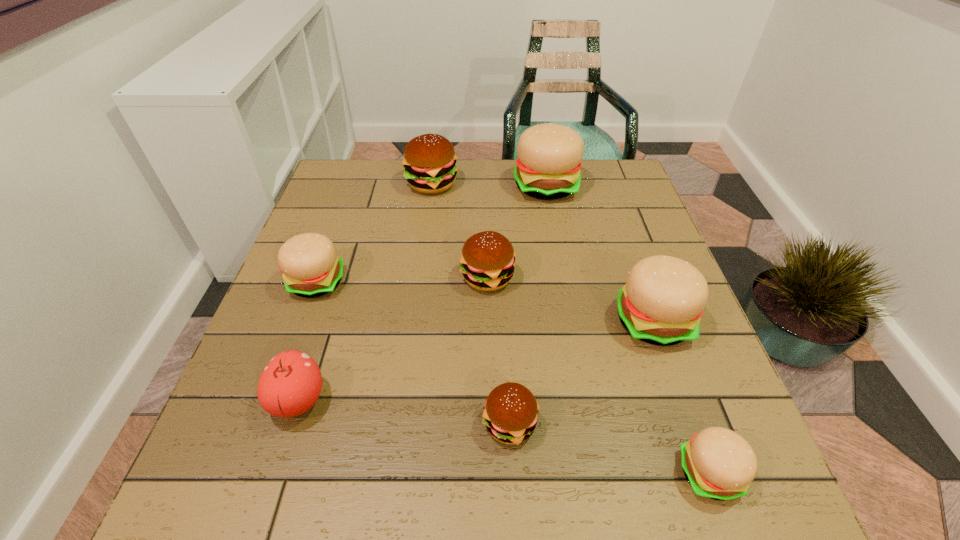
At what (x,y) coordinates should I click in order to perform the action: click on vacant point located 0.070m on the right of the farthest beige hamburger. Please return your answer as a coordinate pair (x, y). The height and width of the screenshot is (540, 960). Looking at the image, I should click on (602, 186).

Identify the location of free region located 0.390m on the right of the third object from left to right. (591, 184).

This screenshot has width=960, height=540. I want to click on vacant space located on the back of the third smallest beige hamburger, so click(617, 221).

At what (x,y) coordinates should I click in order to perform the action: click on vacant space located 0.320m on the back of the second farthest brown hamburger. Please return your answer as a coordinate pair (x, y). This screenshot has height=540, width=960. Looking at the image, I should click on (486, 185).

You are a GUI agent. You are given a task and a screenshot of the screen. Output one action in this format:
    pyautogui.click(x=<x>, y=<y>)
    Task: Click on the blank space located on the back of the leftmost beige hamburger
    This screenshot has width=960, height=540.
    Given the screenshot: What is the action you would take?
    pyautogui.click(x=355, y=177)

Find the location of a particular element. This screenshot has width=960, height=540. vacant space located 0.180m on the right of the apple is located at coordinates (425, 400).

You are a GUI agent. You are given a task and a screenshot of the screen. Output one action in this format:
    pyautogui.click(x=<x>, y=<y>)
    Task: Click on the free location located 0.090m on the back of the smallest brown hamburger
    The image size is (960, 540).
    Given the screenshot: What is the action you would take?
    click(x=507, y=357)

Identify the location of free location located 0.120m on the back of the nearest beige hamburger. The height and width of the screenshot is (540, 960). (677, 382).

You are a GUI agent. You are given a task and a screenshot of the screen. Output one action in this format:
    pyautogui.click(x=<x>, y=<y>)
    Task: Click on the object that is at the near edge
    
    Given the screenshot: What is the action you would take?
    pyautogui.click(x=720, y=464)

At what (x,y) coordinates should I click in order to perform the action: click on hamburger located at the left edge. Please return your answer as a coordinate pair (x, y). Looking at the image, I should click on (311, 268).